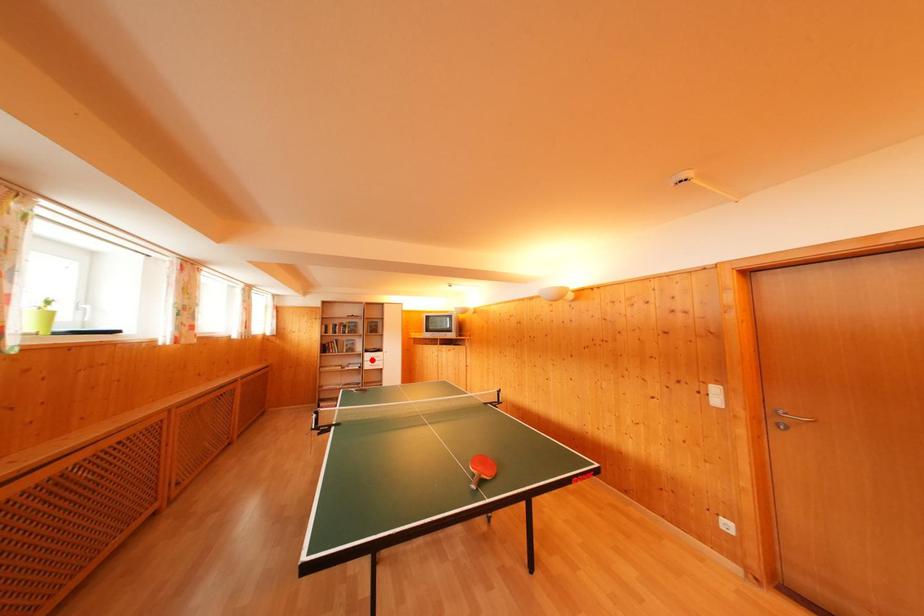
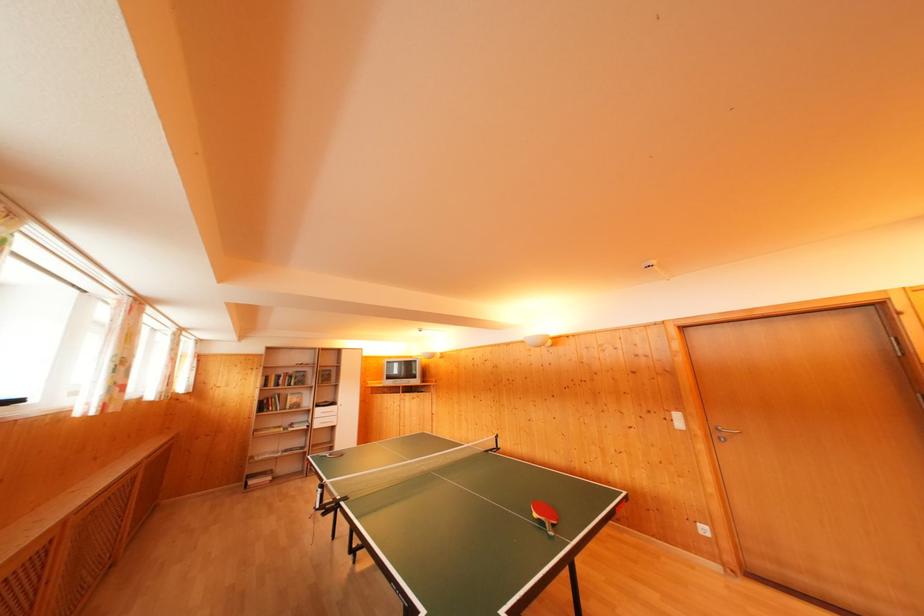
The point at the highlighted location is marked in the first image. Where is the corresponding point in the second image?

(322, 416)